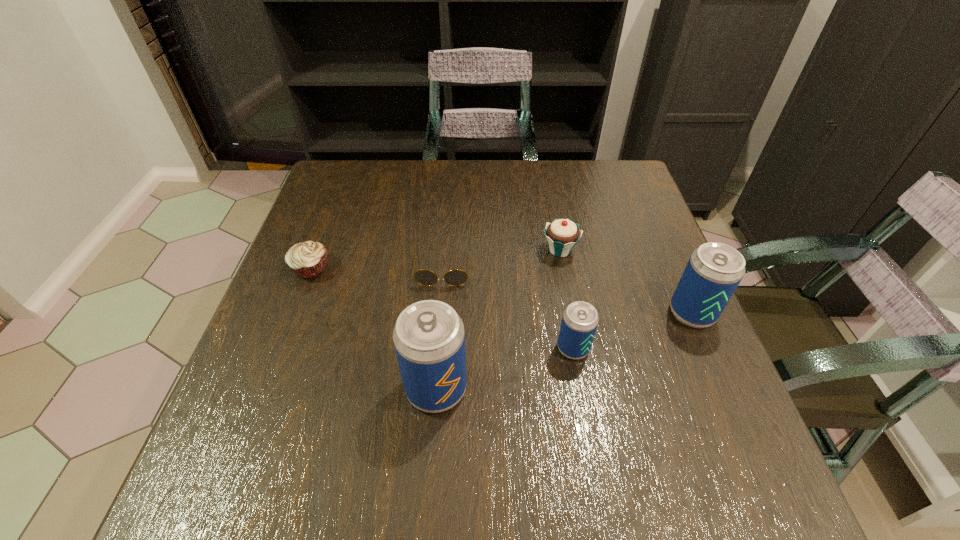
Please show where to add a beer can on the left while keeping spacing even. Please provide its 2D coordinates. Your answer should be formatted as a tuple, i.e. [(x, y)], where the tuple contains the x and y coordinates of a point satisfying the conditions above.

[(276, 435)]